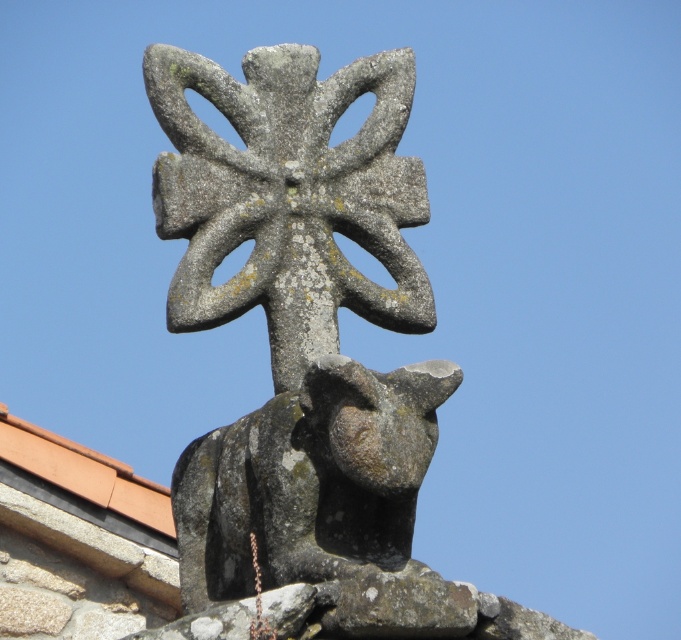
You are an architect inspecting a building. You notice the gray stone cross at center and the terracotta tile roof at upper center. Which object would cast a larger shadow given they are both under the same sunlight conditions?

The gray stone cross at center is bigger than the terracotta tile roof at upper center, so it would cast a larger shadow.

You are an architect examining the stone architectural detail. You notice the gray stone cross at center and the terracotta tile roof at upper center. Based on their positions, which one is higher in the image?

The gray stone cross at center is above the terracotta tile roof at upper center, so it is higher in the image.

You are an architect inspecting a building from the ground. You notice the gray stone cross at center and the terracotta tile roof at upper center. Which object appears taller from your vantage point?

The gray stone cross at center appears taller than the terracotta tile roof at upper center from your vantage point.